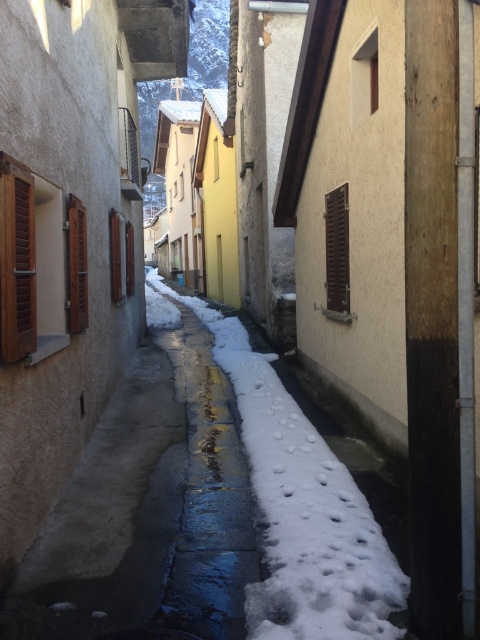
This screenshot has height=640, width=480. What do you see at coordinates (301, 509) in the screenshot? I see `white fluffy snow at center` at bounding box center [301, 509].

Which is more to the right, white fluffy snow at center or brown wooden shutters at left?

white fluffy snow at center is more to the right.

Who is more forward, (x=266, y=490) or (x=14, y=307)?

Point (x=14, y=307) is in front.

Locate an element on the screen. white fluffy snow at center is located at coordinates (301, 509).

Is point (319, 522) farther from viewer compared to point (111, 237)?

No, it is not.

I want to click on white fluffy snow at center, so 301,509.

Identify the location of white fluffy snow at center. (301, 509).

Which is above, white fluffy snow at center or wooden at left?

Positioned higher is wooden at left.

You are a GUI agent. You are given a task and a screenshot of the screen. Output one action in this format:
    pyautogui.click(x=<x>, y=<y>)
    Task: Click on the white fluffy snow at center
    This screenshot has height=640, width=480.
    Given the screenshot: What is the action you would take?
    pyautogui.click(x=301, y=509)